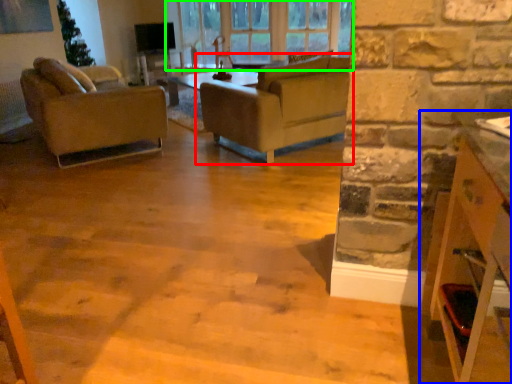
Question: Which object is the farthest from studio couch (highlighted by a red box)? Choose among these: cabinetry (highlighted by a blue box) or window (highlighted by a green box).

Choices:
 (A) cabinetry
 (B) window

Answer: (A)